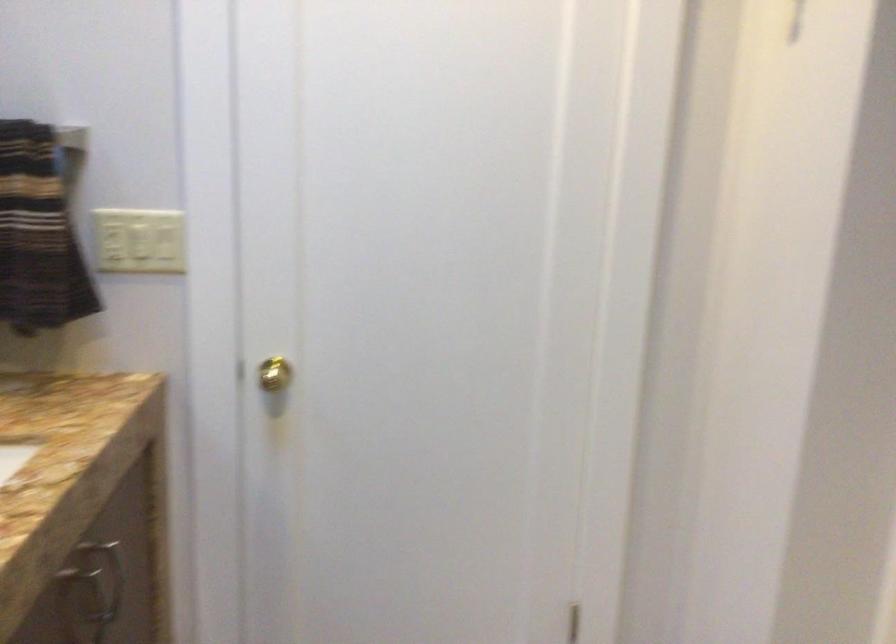
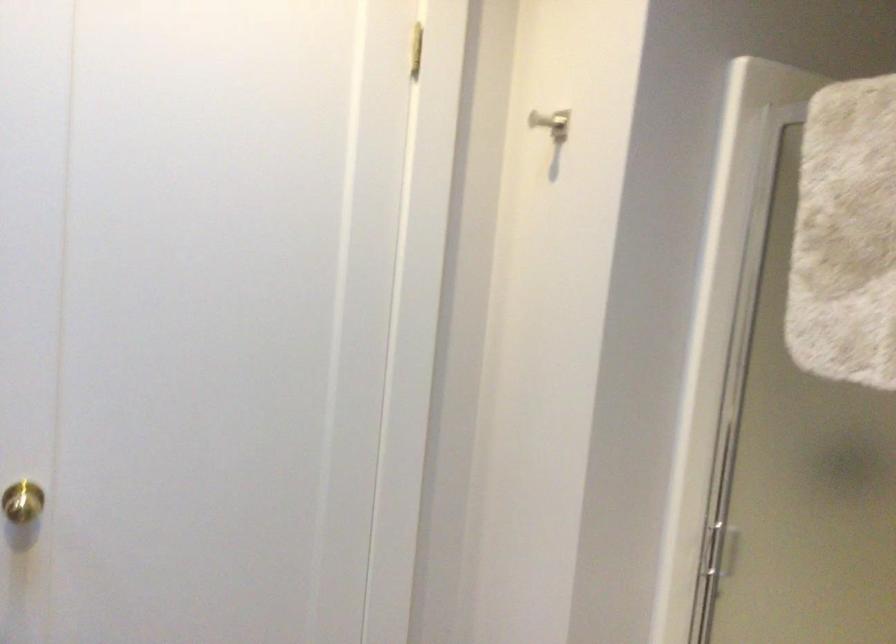
Question: Based on the continuous images, in which direction is the camera rotating? Reply with the corresponding letter.

Choices:
 (A) Left
 (B) Right
 (C) Up
 (D) Down

Answer: (B)